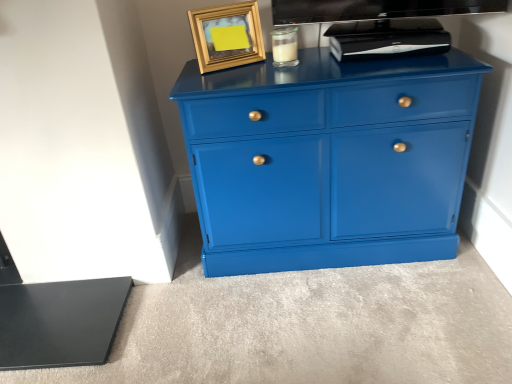
Image resolution: width=512 pixels, height=384 pixels. I want to click on vacant area in front of clear glass jar at upper center, so click(x=311, y=67).